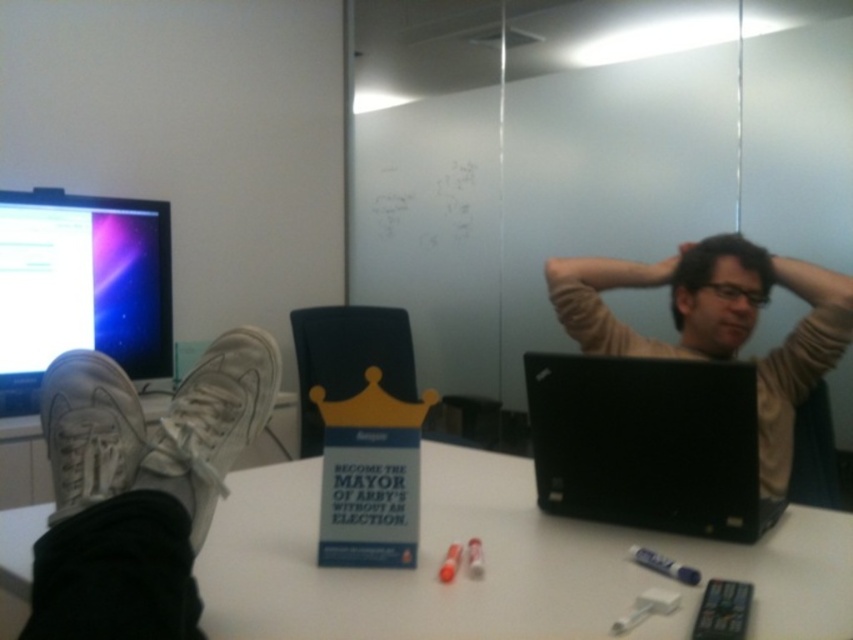
Does matte black monitor at upper left appear over white suede shoe at lower left?

Correct, matte black monitor at upper left is located above white suede shoe at lower left.

This screenshot has height=640, width=853. In order to click on matte black monitor at upper left in this screenshot , I will do `click(80, 285)`.

Who is more distant from viewer, (x=26, y=358) or (x=45, y=381)?

Point (x=26, y=358)

At what (x,y) coordinates should I click in order to perform the action: click on matte black monitor at upper left. Please return your answer as a coordinate pair (x, y). Image resolution: width=853 pixels, height=640 pixels. Looking at the image, I should click on (80, 285).

Who is shorter, matte beige sweater at center or white suede shoe at lower left?

Standing shorter between the two is white suede shoe at lower left.

Can you confirm if matte beige sweater at center is positioned to the left of white suede shoe at lower left?

Incorrect, matte beige sweater at center is not on the left side of white suede shoe at lower left.

What do you see at coordinates (718, 323) in the screenshot? This screenshot has width=853, height=640. I see `matte beige sweater at center` at bounding box center [718, 323].

Image resolution: width=853 pixels, height=640 pixels. Find the location of `matte beige sweater at center`. matte beige sweater at center is located at coordinates (x=718, y=323).

Is white canvas shoe at lower left thinner than matte brown hair at upper center?

Correct, white canvas shoe at lower left's width is less than matte brown hair at upper center's.

Is white canvas shoe at lower left above matte brown hair at upper center?

Actually, white canvas shoe at lower left is below matte brown hair at upper center.

Is point (247, 420) in front of point (712, 262)?

Yes, point (247, 420) is in front of point (712, 262).

This screenshot has height=640, width=853. What are the coordinates of `white canvas shoe at lower left` in the screenshot? It's located at (212, 422).